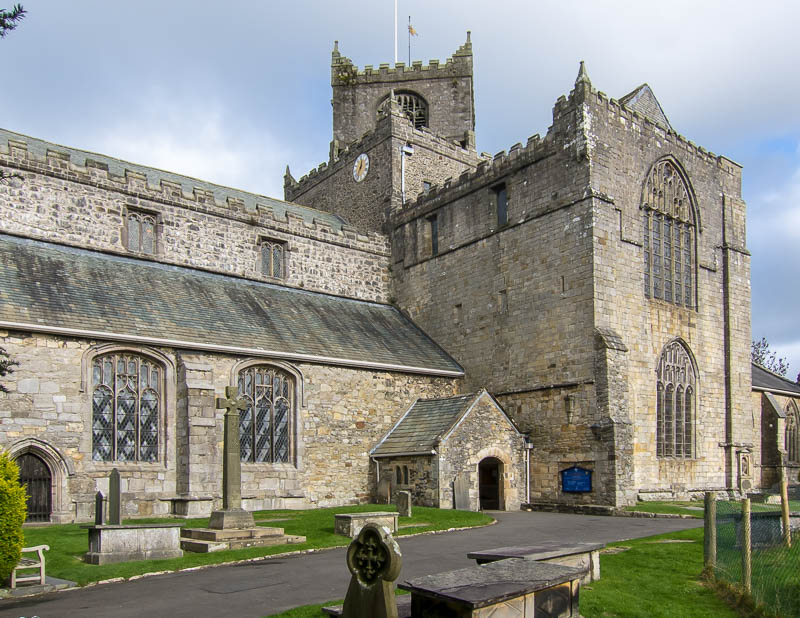
Identify the location of table/rectangle flat surface structures. The width and height of the screenshot is (800, 618). (136, 547), (342, 522), (518, 586), (578, 557), (764, 526).